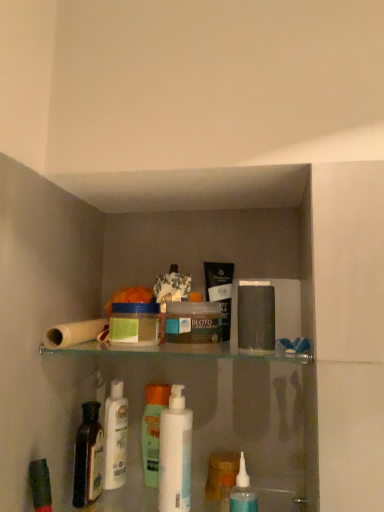
Question: Is translucent plastic bottle at center, positioned as the 1th toiletry in back-to-front order, taller or shorter than white glossy mouthwash at center, acting as the first mouthwash starting from the left?

Choices:
 (A) tall
 (B) short

Answer: (B)

Question: Is point (155, 466) closer or farther from the camera than point (165, 411)?

Choices:
 (A) closer
 (B) farther

Answer: (B)

Question: Which is nearer to the white matte toilet paper at left?

Choices:
 (A) dark brown glass bottle at lower left
 (B) clear plastic container at center, placed as the 2th toiletry when sorted from back to front
 (C) clear glass shelf at center
 (D) white glossy mouthwash at center, which is the first mouthwash from back to front
 (E) green matte jar at center, which appears as the 2th product when viewed from the right

Answer: (E)

Question: Which object is positioned closest to the white glossy bottle at lower left?

Choices:
 (A) green matte jar at center, the 1th product in the left-to-right sequence
 (B) white matte toilet paper at left
 (C) translucent plastic bottle at lower center, the 2th mouthwash in the back-to-front sequence
 (D) translucent plastic bottle at center, the 2th toiletry in the right-to-left sequence
 (E) white glossy mouthwash at center, marked as the second mouthwash in a right-to-left arrangement

Answer: (D)